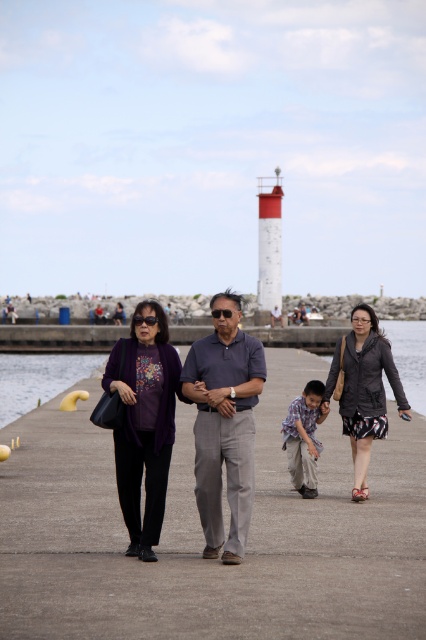
Between dark gray textured jacket at center and yellow rubber duck at lower left, which one has more height?

dark gray textured jacket at center is taller.

Looking at this image, is dark gray textured jacket at center smaller than yellow rubber duck at lower left?

Yes, dark gray textured jacket at center is smaller than yellow rubber duck at lower left.

Does point (359, 365) come closer to viewer compared to point (5, 394)?

Yes.

Locate an element on the screen. dark gray textured jacket at center is located at coordinates (367, 392).

Is purple matte sweater at center thinner than dark gray textured jacket at center?

Yes, purple matte sweater at center is thinner than dark gray textured jacket at center.

Is purple matte sweater at center behind dark gray textured jacket at center?

No, it is not.

Image resolution: width=426 pixels, height=640 pixels. Describe the element at coordinates (143, 420) in the screenshot. I see `purple matte sweater at center` at that location.

This screenshot has height=640, width=426. I want to click on purple matte sweater at center, so click(x=143, y=420).

Is point (241, 538) positioned before point (149, 561)?

No, (241, 538) is behind (149, 561).

Which is below, gray cotton shirt at center or purple matte sweater at center?

gray cotton shirt at center is lower down.

Between point (212, 371) and point (117, 353), which one is positioned in front?

Point (212, 371)

Locate an element on the screen. gray cotton shirt at center is located at coordinates (224, 422).